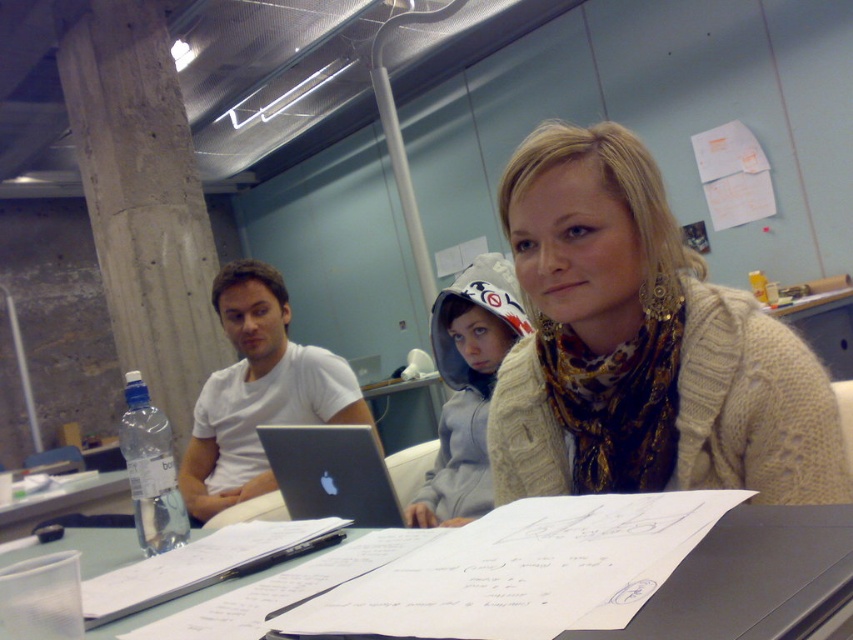
You are trying to decide where to place a new plant stand in the room. The stand is 1.2 meters tall. The concrete at left and the silver metallic laptop at center are in your way. Which object will block the view of the plant stand more if placed behind it?

The concrete at left is much taller than the silver metallic laptop at center, so placing the plant stand behind the concrete at left will block the view more than placing it behind the silver metallic laptop at center.

You are standing at the entrance of the room and want to place a large potted plant in front of the concrete at left without blocking the silver metallic laptop at center. Is this possible?

The silver metallic laptop at center is behind the concrete at left, so placing the potted plant in front of the concrete at left would not block the laptop since it is already behind the concrete.